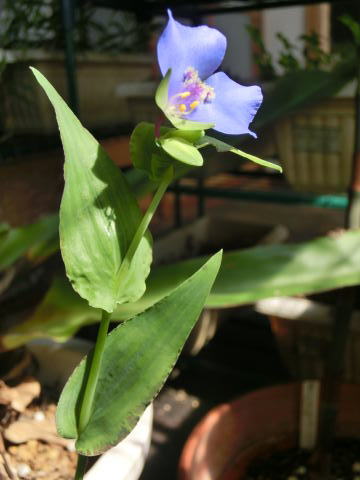
At what (x,y) coordinates should I click in order to perform the action: click on white planter. Please return your answer as a coordinate pair (x, y). The width and height of the screenshot is (360, 480). Looking at the image, I should click on (126, 452).